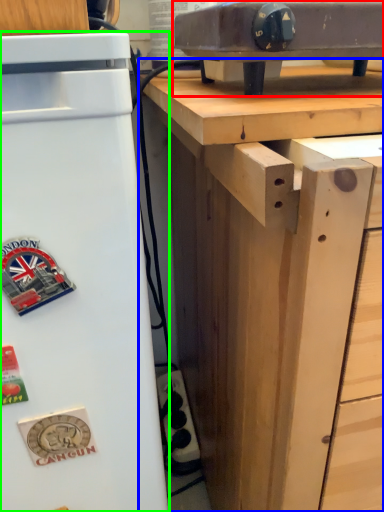
Question: Which object is the farthest from appliance (highlighted by a red box)? Choose among these: desk (highlighted by a blue box) or refrigerator (highlighted by a green box).

Choices:
 (A) desk
 (B) refrigerator

Answer: (B)